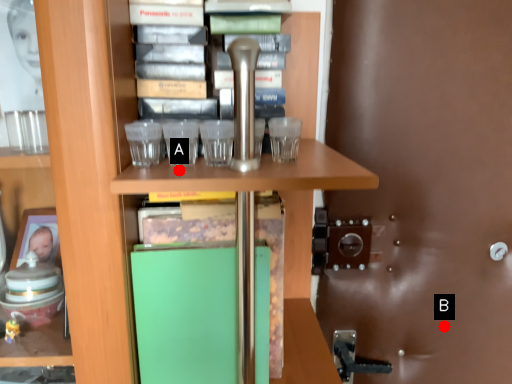
Question: Two points are circled on the image, labeled by A and B beside each circle. Among these points, which one is farthest from the camera?

Choices:
 (A) A is further
 (B) B is further

Answer: (B)